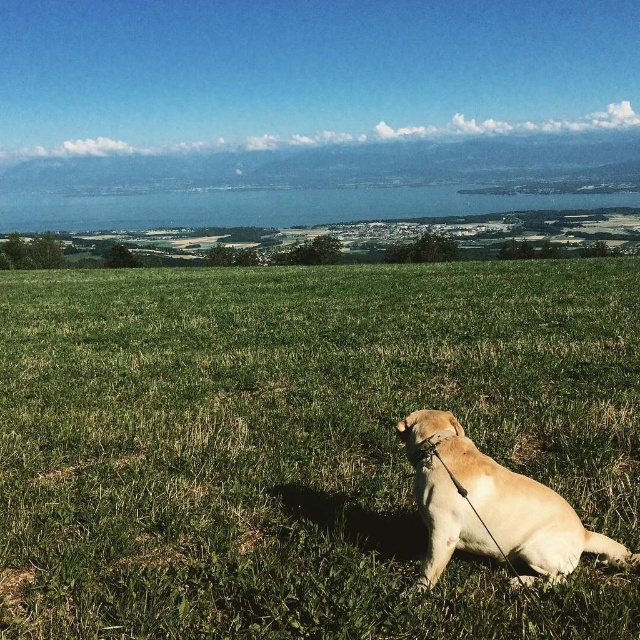
Question: Among these points, which one is nearest to the camera?

Choices:
 (A) (512, 545)
 (B) (35, 372)

Answer: (A)

Question: Can you confirm if green grassy field at center is wider than golden fur dog at lower right?

Choices:
 (A) yes
 (B) no

Answer: (A)

Question: Does green grassy field at center lie in front of golden fur dog at lower right?

Choices:
 (A) yes
 (B) no

Answer: (A)

Question: Does green grassy field at center appear over golden fur dog at lower right?

Choices:
 (A) yes
 (B) no

Answer: (A)